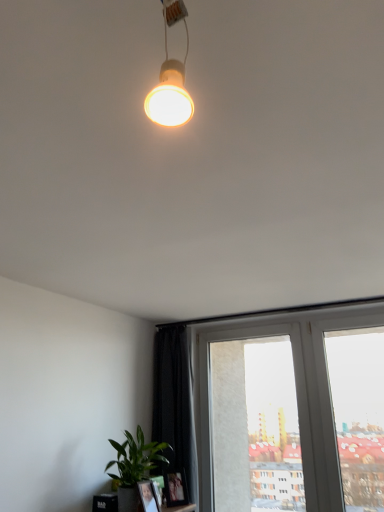
Question: Is green matte plant at lower left far from white plastic window frame at center?

Choices:
 (A) yes
 (B) no

Answer: (A)

Question: Is green matte plant at lower left facing towards white plastic window frame at center?

Choices:
 (A) no
 (B) yes

Answer: (A)

Question: Considering the relative positions of green matte plant at lower left and white plastic window frame at center in the image provided, is green matte plant at lower left behind white plastic window frame at center?

Choices:
 (A) yes
 (B) no

Answer: (B)

Question: Is green matte plant at lower left shorter than white plastic window frame at center?

Choices:
 (A) yes
 (B) no

Answer: (A)

Question: Does green matte plant at lower left come in front of white plastic window frame at center?

Choices:
 (A) yes
 (B) no

Answer: (A)

Question: Is the surface of green matte plant at lower left in direct contact with white plastic window frame at center?

Choices:
 (A) no
 (B) yes

Answer: (A)

Question: Is green matte plant at lower left a part of white plastic window frame at center?

Choices:
 (A) no
 (B) yes

Answer: (A)

Question: From the image's perspective, would you say white plastic window frame at center is positioned over green matte plant at lower left?

Choices:
 (A) no
 (B) yes

Answer: (A)

Question: Is white plastic window frame at center next to green matte plant at lower left?

Choices:
 (A) no
 (B) yes

Answer: (A)

Question: Is white plastic window frame at center wider than green matte plant at lower left?

Choices:
 (A) yes
 (B) no

Answer: (B)

Question: From a real-world perspective, is white plastic window frame at center over green matte plant at lower left?

Choices:
 (A) yes
 (B) no

Answer: (A)

Question: From a real-world perspective, is white plastic window frame at center physically below green matte plant at lower left?

Choices:
 (A) yes
 (B) no

Answer: (B)

Question: In the image, is green matte plant at lower left on the left side or the right side of white plastic window frame at center?

Choices:
 (A) left
 (B) right

Answer: (A)